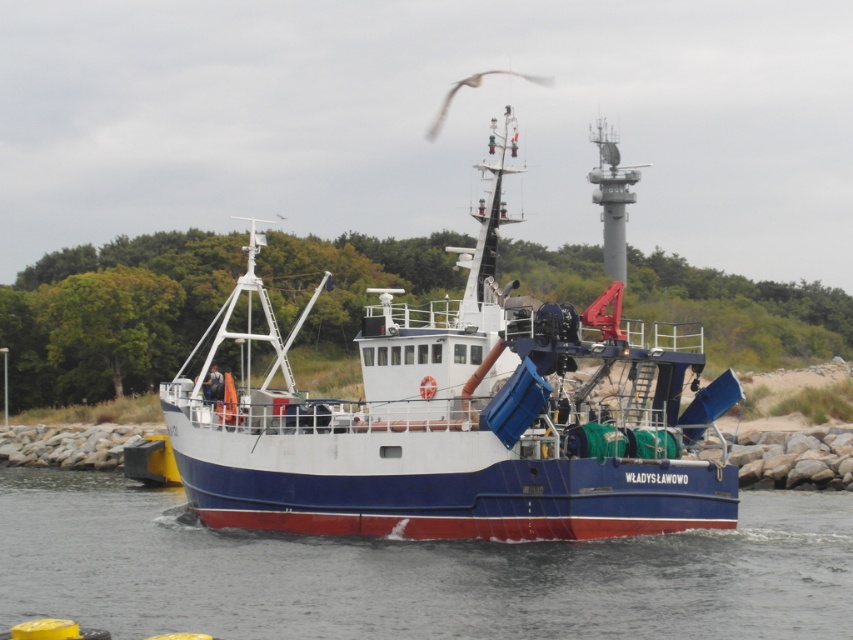
You are a sailor on the blue matte boat at center. You want to navigate towards the lighthouse in the background. Since the blue smooth water at center is behind your boat, which direction should you steer the boat to move forward?

Since the blue smooth water at center is behind the blue matte boat at center, you should steer the boat away from the blue smooth water at center to move forward towards the lighthouse in the background.

You are a sailor on the blue matte boat at center. You want to jump into the blue smooth water at center. Is the water directly below you?

The blue matte boat at center is above the blue smooth water at center, so yes, the water is directly below you.

You are standing on the deck of the fishing boat named W?ADYS?AWOWO and want to take a photo of two specific points on the boat. The first point is located at coordinates point [270,525] and the second at point [492,70]. Which point will appear larger in your photo?

Point [270,525] will appear larger in the photo because it is closer to the camera than point [492,70].